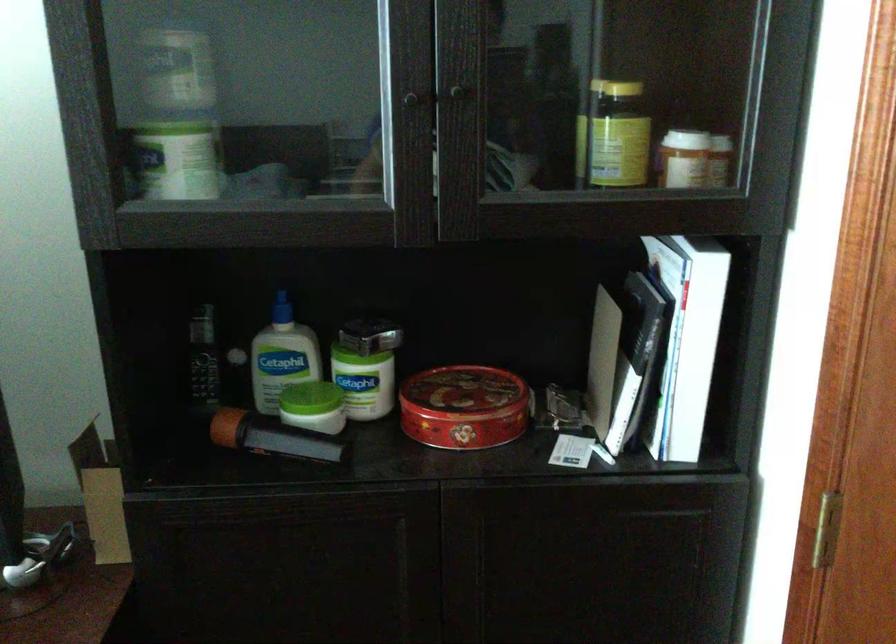
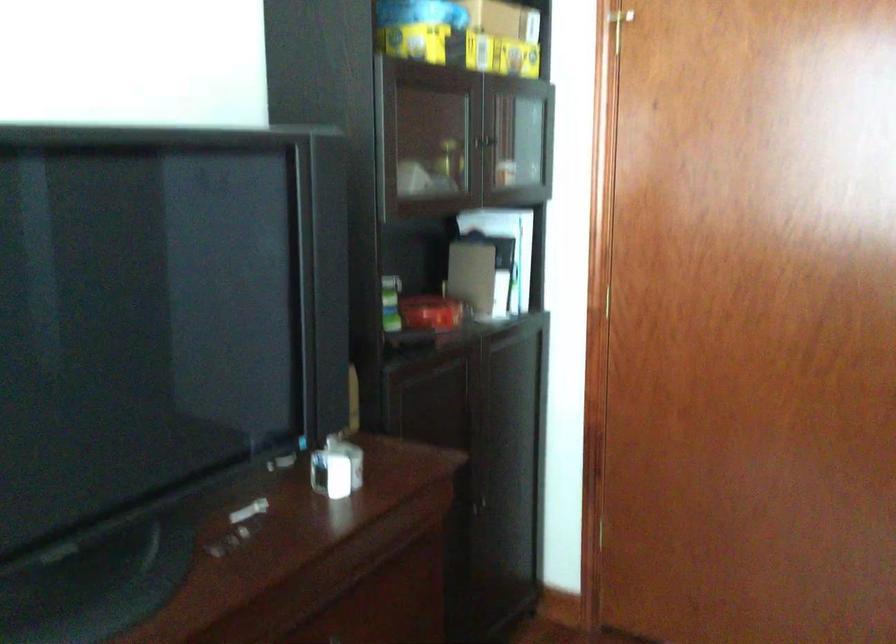
Question: I am providing you with two images of the same scene from different viewpoints. After the viewpoint changes to image2, which objects are now occluded?

Choices:
 (A) yellow bottle cap
 (B) yellow cardboard box
 (C) toilet paper piece
 (D) cabinet handle

Answer: (A)